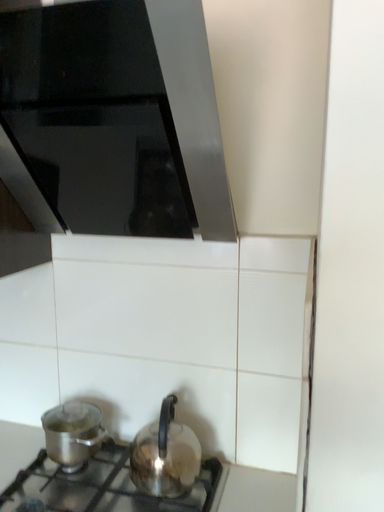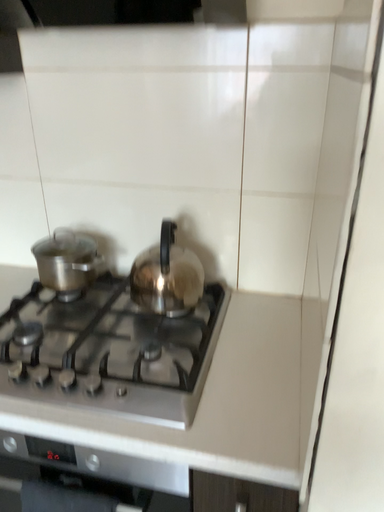
Question: How did the camera likely rotate when shooting the video?

Choices:
 (A) rotated downward
 (B) rotated upward

Answer: (A)